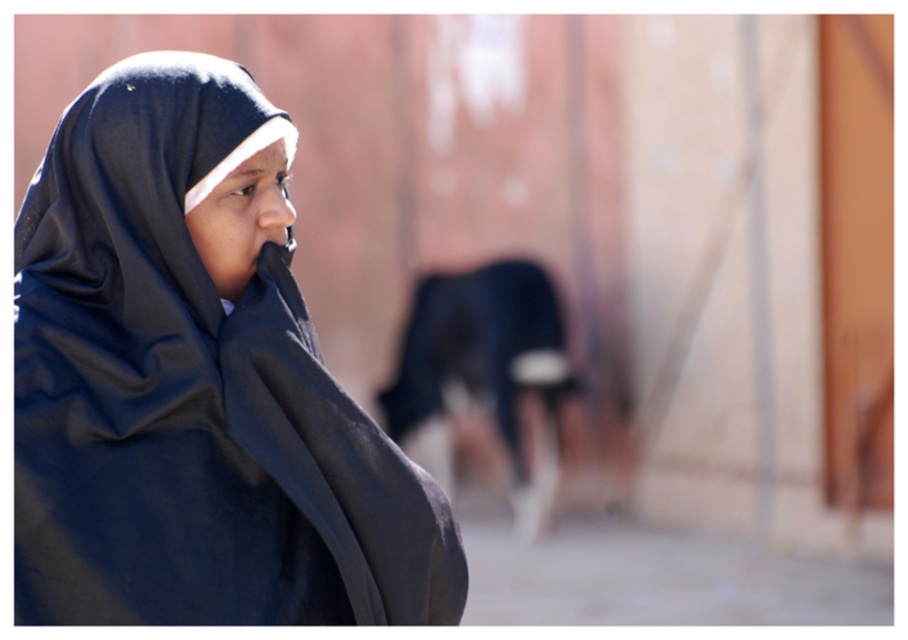
You are a photographer who wants to take a picture of the dark blue fur at center. You notice there is a matte black hijab at left in the frame. Based on their positions, which object should you adjust your camera to focus on first to ensure both are in focus?

The matte black hijab at left is to the left of dark blue fur at center, so you should focus on the matte black hijab at left first since it is closer to the camera. This will ensure the depth of field captures both objects in focus.

You are a photographer adjusting your camera settings to focus on the matte black hijab at left and the dark blue fur at center. Which object should you focus on to ensure both are in focus given their positions?

The matte black hijab at left is positioned over the dark blue fur at center, so focusing on the matte black hijab at left will ensure both are in focus since it is closer to the camera.